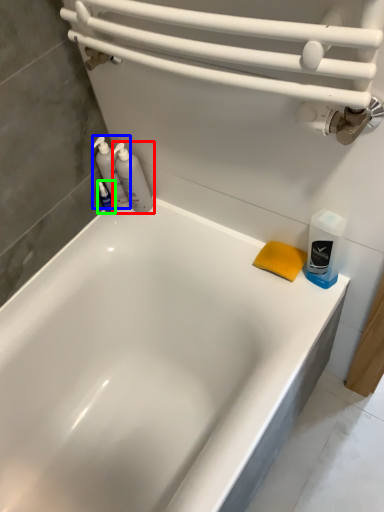
Question: Which object is the farthest from cleaning product (highlighted by a red box)? Choose among these: cleaning product (highlighted by a blue box) or toiletry (highlighted by a green box).

Choices:
 (A) cleaning product
 (B) toiletry

Answer: (B)